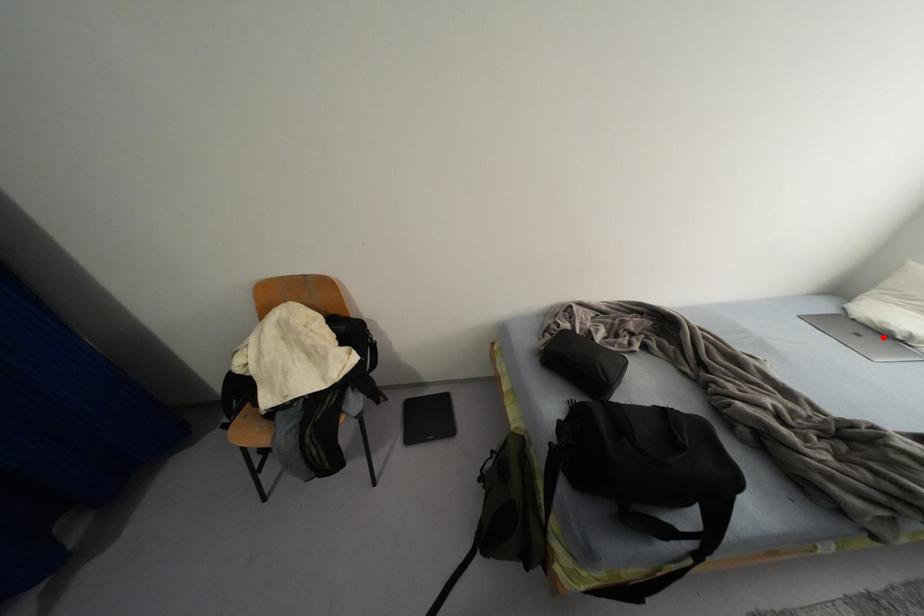
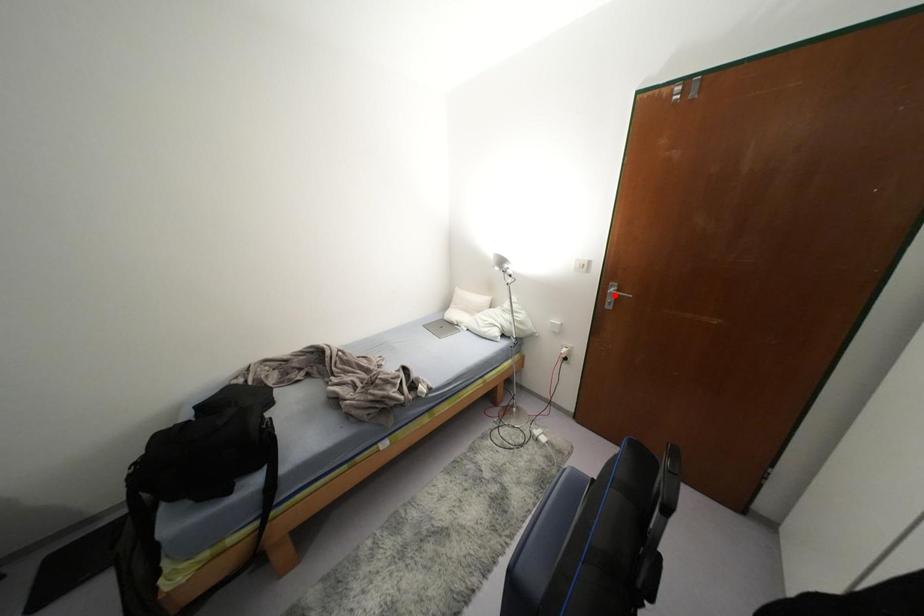
I am providing you with two images of the same scene from different viewpoints. A red point is marked on the first image and another point is marked on the second image. Is the red point in image1 aligned with the point shown in image2?

No